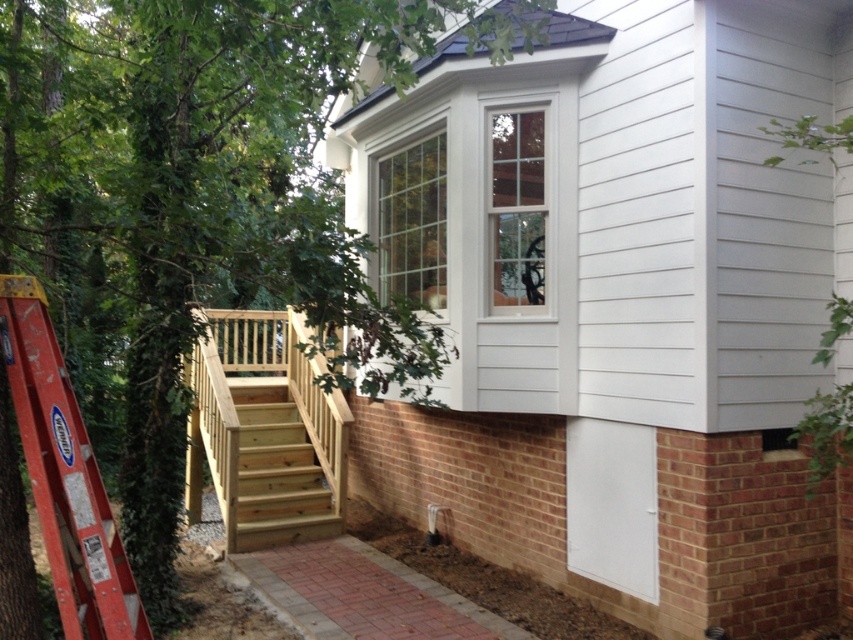
You are a painter who needs to reach the second floor of the house to paint the bay window. You have the red metal ladder at left and the light brown wooden stairs at center available. Which one should you use to safely reach the bay window?

The red metal ladder at left has a greater height compared to the light brown wooden stairs at center, so you should use the red metal ladder at left to safely reach the bay window.

You are a painter who needs to reach the second floor of the house to paint the bay window. You have the red metal ladder at left and the light brown wooden stairs at center available. Which one should you use to safely reach the bay window?

The light brown wooden stairs at center should be used because the red metal ladder at left is smaller and may not be tall enough to safely reach the second floor bay window.